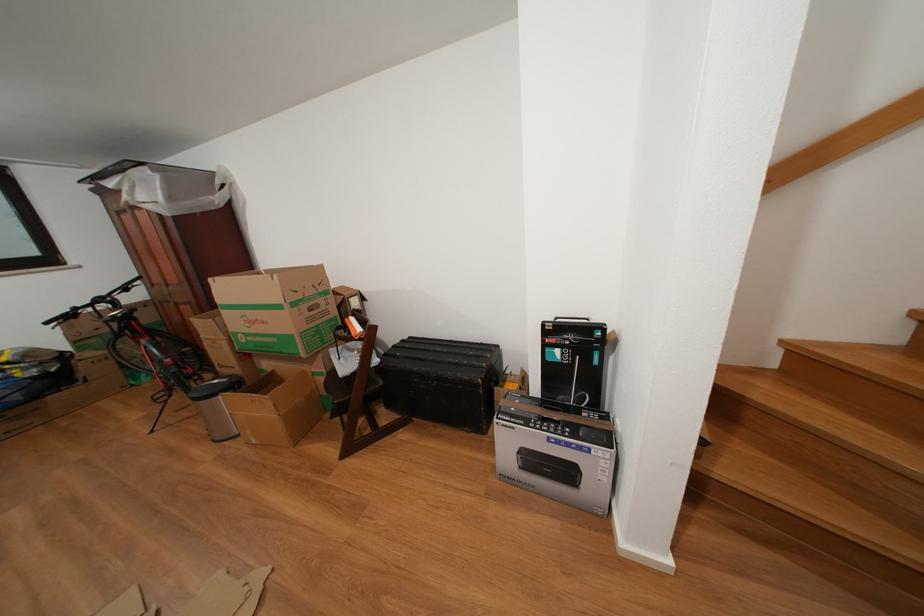
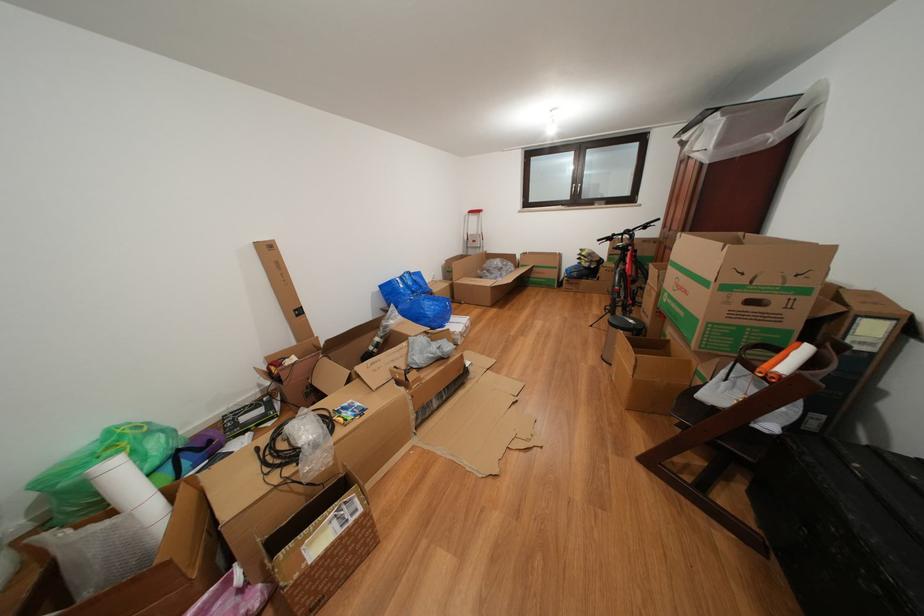
The point at (83, 314) is marked in the first image. Where is the corresponding point in the second image?

(622, 240)